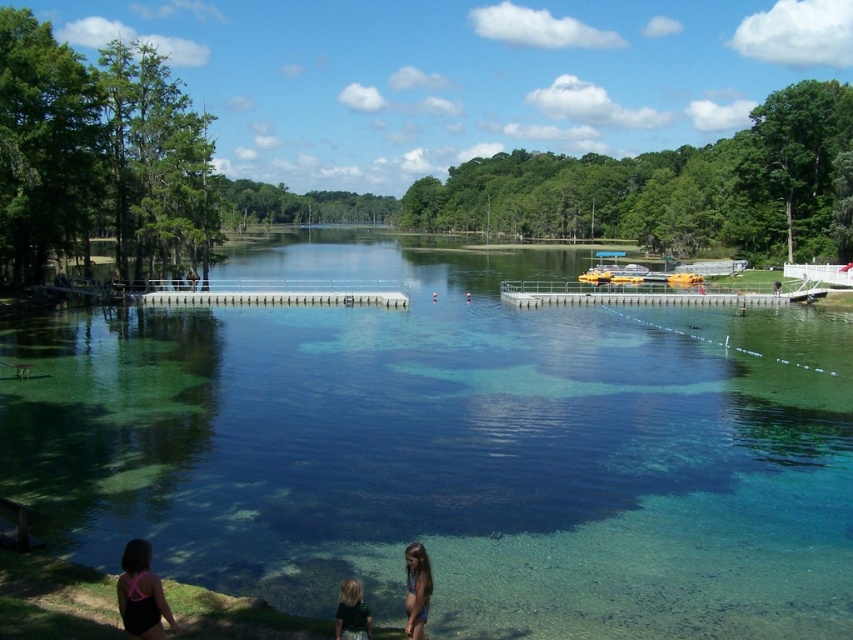
You are standing at the edge of the water in the scene. There is a point marked at coordinates (451, 449). What is the nature of the surface at that point?

The point at coordinates (451, 449) is on clear glass water at center, which means the surface there is calm and reflective, as described in the scene.

You are a photographer positioned at the center of the scene. You notice a person with light brown hair at lower center. Where exactly is this person located in relation to the center of the scene?

The light brown hair at lower center is located at point (x=416, y=589), which means it is positioned to the right and slightly above the center of the scene.